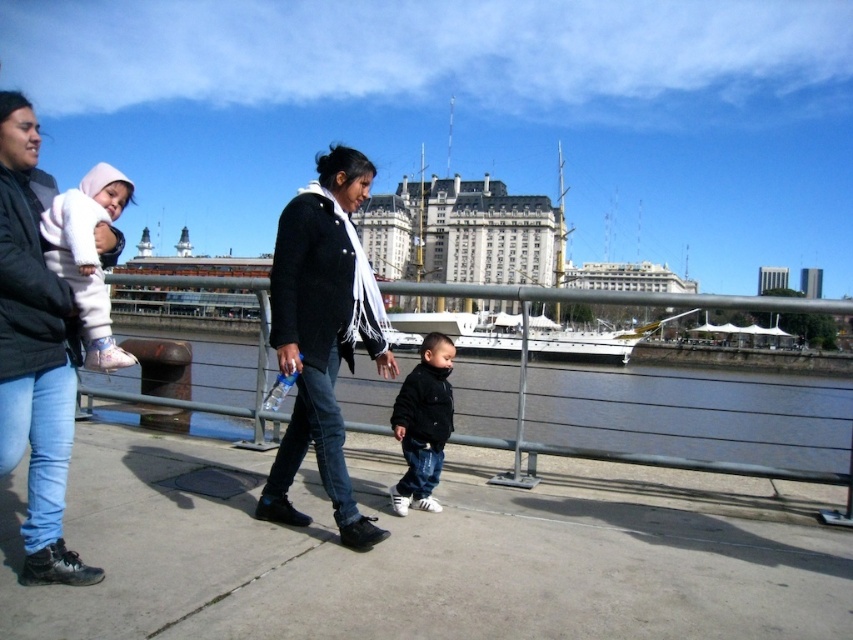
Between concrete sidewalk at center and black matte jacket at center, which one is positioned lower?

concrete sidewalk at center

From the picture: Who is positioned more to the right, concrete sidewalk at center or black matte jacket at center?

black matte jacket at center is more to the right.

The height and width of the screenshot is (640, 853). I want to click on concrete sidewalk at center, so click(408, 563).

Locate an element on the screen. This screenshot has width=853, height=640. concrete sidewalk at center is located at coordinates (408, 563).

Based on the photo, who is taller, concrete sidewalk at center or white fleece jacket at upper left?

With more height is white fleece jacket at upper left.

Find the location of a particular element. concrete sidewalk at center is located at coordinates (408, 563).

Is point (828, 602) positioned behind point (97, 266)?

No, it is not.

Locate an element on the screen. This screenshot has width=853, height=640. concrete sidewalk at center is located at coordinates [408, 563].

Does smooth concrete walkway at lower center have a lesser height compared to black matte jacket at center?

No, smooth concrete walkway at lower center is not shorter than black matte jacket at center.

Is point (799, 397) positioned before point (444, 416)?

No, (799, 397) is further to viewer.

At what (x,y) coordinates should I click in order to perform the action: click on smooth concrete walkway at lower center. Please return your answer as a coordinate pair (x, y). Looking at the image, I should click on (691, 420).